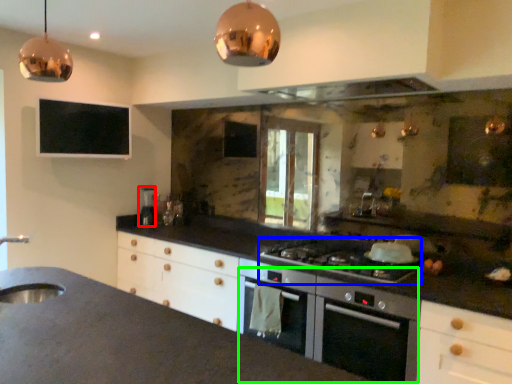
Question: Estimate the real-world distances between objects in this image. Which object is farther from appliance (highlighted by a red box), gas stove (highlighted by a blue box) or oven (highlighted by a green box)?

Choices:
 (A) gas stove
 (B) oven

Answer: (B)